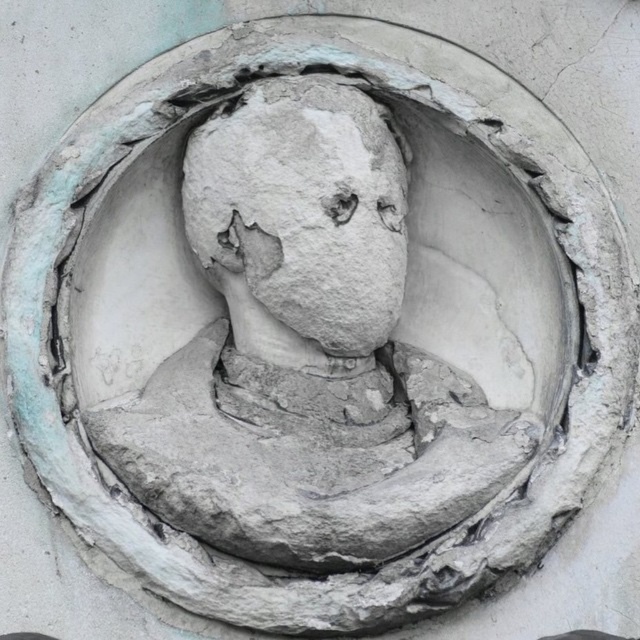
You are an art conservator examining the circular relief sculpture. You notice two elements, the white stone bust at center and the gray stone face at center. Which one is located lower in the sculpture?

The white stone bust at center is positioned under the gray stone face at center, so the white stone bust at center is located lower in the sculpture.

You are an art conservator examining the circular relief sculpture. You notice two elements at the center of the sculpture. One is labeled as the white stone bust at center and the other as the gray stone face at center. Based on their positions and the description provided, which of these two elements is wider?

The white stone bust at center is wider than the gray stone face at center according to the description provided.